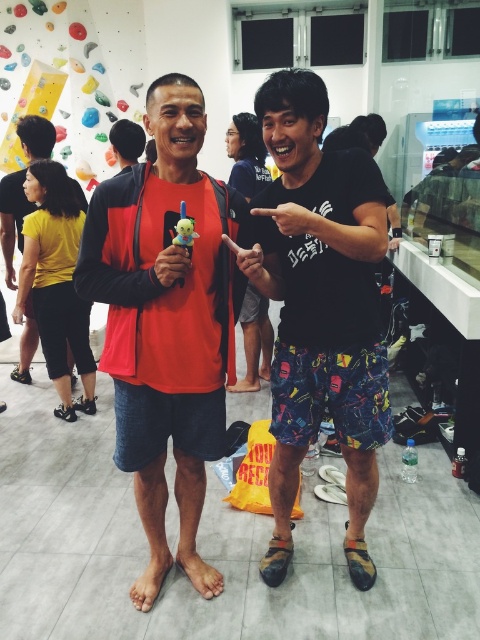
Question: Which point is closer to the camera taking this photo?

Choices:
 (A) (122, 266)
 (B) (48, 122)
 (C) (372, 211)

Answer: (C)

Question: Can you confirm if matte orange shirt at center is positioned to the left of matte orange tank top at center?

Choices:
 (A) yes
 (B) no

Answer: (B)

Question: Among these points, which one is farthest from the camera?

Choices:
 (A) (196, 364)
 (B) (260, 246)

Answer: (A)

Question: Is matte orange shirt at center closer to the viewer compared to matte orange tank top at center?

Choices:
 (A) yes
 (B) no

Answer: (A)

Question: Is black matte shorts at center thinner than matte orange tank top at center?

Choices:
 (A) yes
 (B) no

Answer: (B)

Question: Which point is farther to the camera?

Choices:
 (A) matte orange tank top at center
 (B) matte orange shirt at center
 (C) black matte shorts at center

Answer: (A)